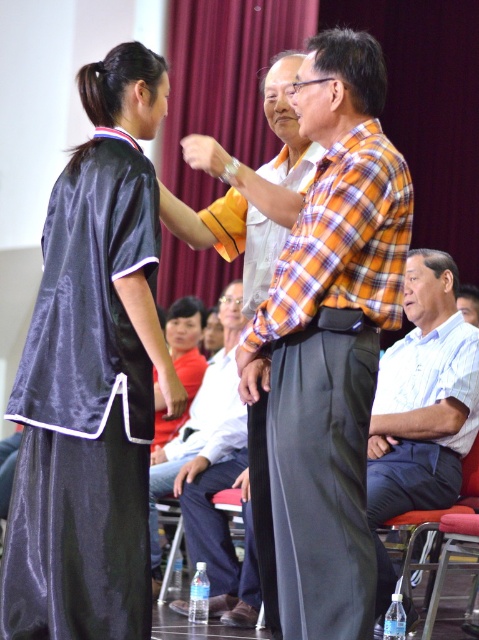
Question: From the image, what is the correct spatial relationship of silky black robe at center in relation to white cotton shirt at center?

Choices:
 (A) right
 (B) left

Answer: (A)

Question: Among these objects, which one is nearest to the camera?

Choices:
 (A) white cotton shirt at center
 (B) white cotton shirt at right

Answer: (B)

Question: Which point is closer to the camera taking this photo?

Choices:
 (A) (452, 496)
 (B) (258, 330)

Answer: (B)

Question: Is silky black robe at center bigger than white cotton shirt at right?

Choices:
 (A) yes
 (B) no

Answer: (B)

Question: Which object is the farthest from the white cotton shirt at center?

Choices:
 (A) satin black robe at left
 (B) silky black robe at center

Answer: (B)

Question: Is satin black robe at left above white cotton shirt at center?

Choices:
 (A) no
 (B) yes

Answer: (B)